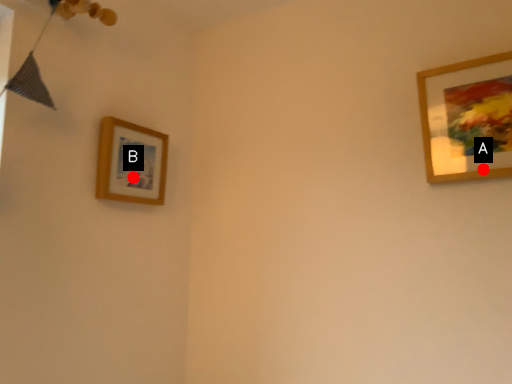
Question: Two points are circled on the image, labeled by A and B beside each circle. Which point is closer to the camera taking this photo?

Choices:
 (A) A is closer
 (B) B is closer

Answer: (A)